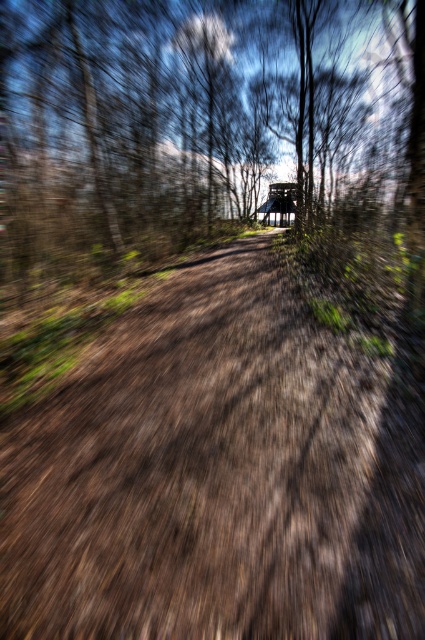
Question: Which point is farther to the camera?

Choices:
 (A) brown dirt track at center
 (B) wooden hut at center

Answer: (B)

Question: Is brown dirt track at center to the right of wooden hut at center from the viewer's perspective?

Choices:
 (A) yes
 (B) no

Answer: (B)

Question: Is brown dirt track at center thinner than wooden hut at center?

Choices:
 (A) yes
 (B) no

Answer: (B)

Question: Which object appears farthest from the camera in this image?

Choices:
 (A) brown dirt track at center
 (B) wooden hut at center

Answer: (B)

Question: Observing the image, what is the correct spatial positioning of brown dirt track at center in reference to wooden hut at center?

Choices:
 (A) right
 (B) left

Answer: (B)